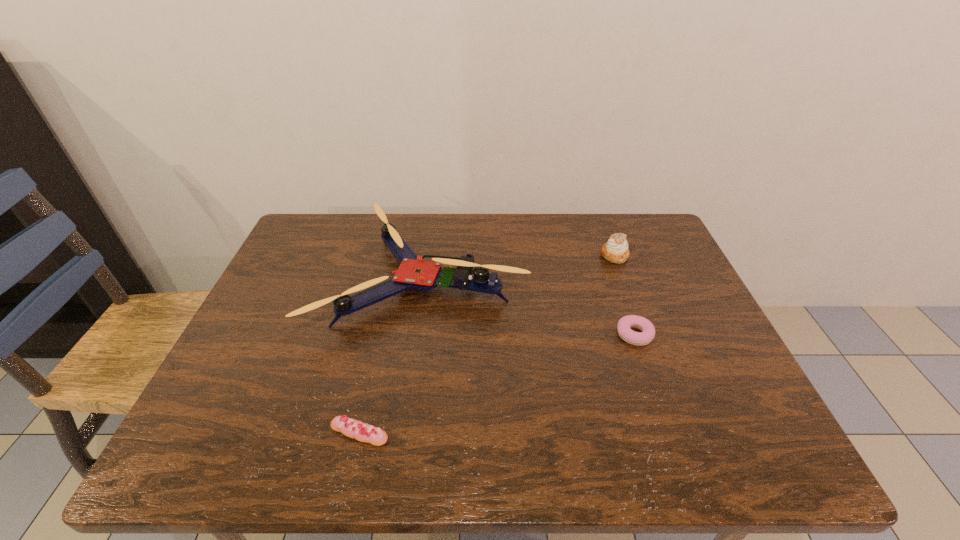
Find the location of a particular element. the tallest object is located at coordinates pyautogui.click(x=413, y=273).

Find the location of a particular element. The image size is (960, 540). the farther pastry is located at coordinates (616, 250).

Locate an element on the screen. The width and height of the screenshot is (960, 540). the taller pastry is located at coordinates click(616, 250).

Find the location of a particular element. This screenshot has width=960, height=540. the nearer pastry is located at coordinates (624, 326).

Find the location of a particular element. Image resolution: width=960 pixels, height=540 pixels. the nearest object is located at coordinates (363, 432).

Locate an element on the screen. Image resolution: width=960 pixels, height=540 pixels. free space located 0.160m on the right of the drone is located at coordinates (581, 277).

This screenshot has width=960, height=540. Find the location of `vacant space located on the front of the taller pastry`. vacant space located on the front of the taller pastry is located at coordinates (653, 360).

Locate an element on the screen. The image size is (960, 540). free spot located 0.130m on the left of the shorter pastry is located at coordinates (564, 335).

Locate an element on the screen. The height and width of the screenshot is (540, 960). free spot located 0.220m on the back of the nearest object is located at coordinates (380, 338).

Locate an element on the screen. The height and width of the screenshot is (540, 960). drone that is at the far edge is located at coordinates (413, 273).